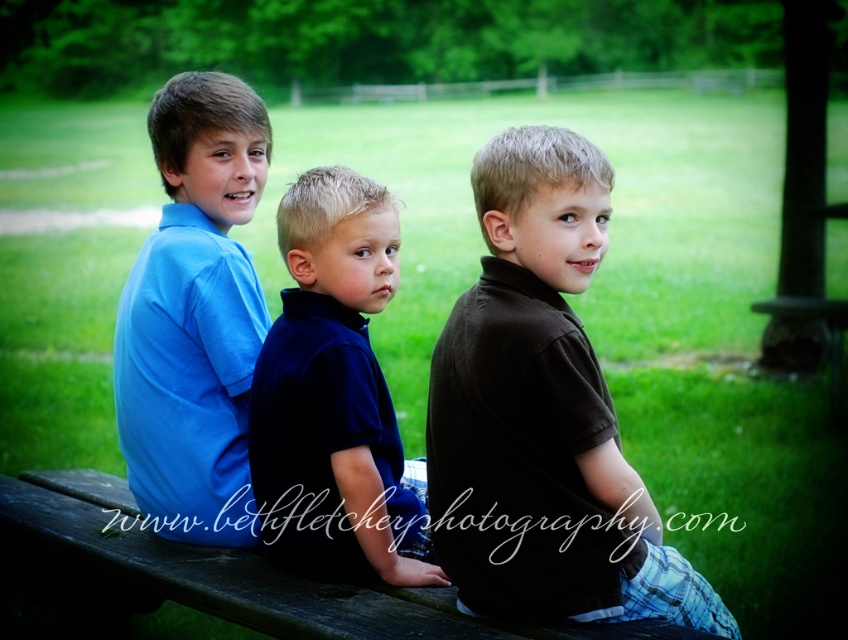
Question: Observing the image, what is the correct spatial positioning of dark blue velvety shirt at center in reference to wooden park bench at center?

Choices:
 (A) right
 (B) left

Answer: (A)

Question: Among these objects, which one is farthest from the camera?

Choices:
 (A) matte blue shirt at center
 (B) brown cotton shirt at center
 (C) wooden park bench at center
 (D) dark blue velvety shirt at center

Answer: (A)

Question: Is brown cotton shirt at center wider than matte blue shirt at center?

Choices:
 (A) yes
 (B) no

Answer: (A)

Question: Which point appears farthest from the camera in this image?

Choices:
 (A) coord(261,298)
 (B) coord(227,568)
 (C) coord(540,221)
 (D) coord(327,376)

Answer: (A)

Question: Can you confirm if brown cotton shirt at center is positioned below wooden park bench at center?

Choices:
 (A) yes
 (B) no

Answer: (B)

Question: Which point appears closest to the camera in this image?

Choices:
 (A) (488, 605)
 (B) (236, 164)
 (C) (512, 628)
 (D) (361, 337)

Answer: (C)